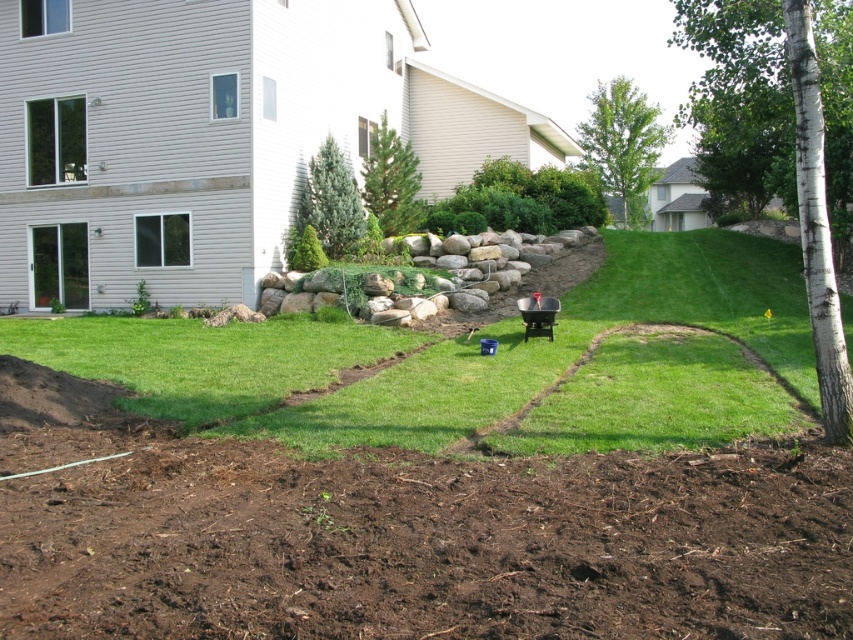
Who is positioned more to the right, green leafy bush at center or green fir tree at center?

green leafy bush at center is more to the right.

Locate an element on the screen. green leafy bush at center is located at coordinates (524, 198).

Identify the location of green leafy bush at center. The image size is (853, 640). (524, 198).

Is green fir tree at center to the left of green textured pine tree at center from the viewer's perspective?

Indeed, green fir tree at center is positioned on the left side of green textured pine tree at center.

Where is `green fir tree at center`? The width and height of the screenshot is (853, 640). green fir tree at center is located at coordinates (332, 200).

Which is behind, point (448, 225) or point (618, 138)?

The point (618, 138) is behind.

Consider the image. Is green leafy bush at center taller than green leafy tree at upper center?

Incorrect, green leafy bush at center's height is not larger of green leafy tree at upper center's.

This screenshot has height=640, width=853. I want to click on green leafy bush at center, so click(524, 198).